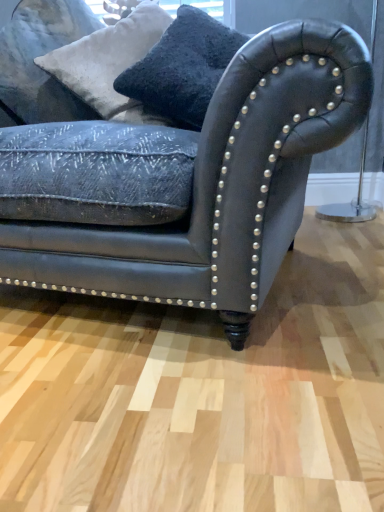
Question: Considering the relative positions of leather couch at center and velvety black pillow at upper center, the 2th pillow when ordered from left to right, in the image provided, is leather couch at center to the left of velvety black pillow at upper center, the 2th pillow when ordered from left to right, from the viewer's perspective?

Choices:
 (A) no
 (B) yes

Answer: (B)

Question: Are leather couch at center and velvety black pillow at upper center, the 1th pillow from the right, far apart?

Choices:
 (A) no
 (B) yes

Answer: (A)

Question: Can you confirm if leather couch at center is smaller than velvety black pillow at upper center, the 1th pillow from the right?

Choices:
 (A) yes
 (B) no

Answer: (B)

Question: Is leather couch at center oriented away from velvety black pillow at upper center, the 1th pillow from the right?

Choices:
 (A) no
 (B) yes

Answer: (A)

Question: Is velvety black pillow at upper center, the 2th pillow when ordered from left to right, a part of leather couch at center?

Choices:
 (A) yes
 (B) no

Answer: (A)

Question: Is white textured pillow at upper left, the 2th pillow in the right-to-left sequence, taller or shorter than leather couch at center?

Choices:
 (A) short
 (B) tall

Answer: (A)

Question: From a real-world perspective, is white textured pillow at upper left, the first pillow viewed from the left, above or below leather couch at center?

Choices:
 (A) above
 (B) below

Answer: (A)

Question: Choose the correct answer: Is white textured pillow at upper left, the 2th pillow in the right-to-left sequence, inside leather couch at center or outside it?

Choices:
 (A) outside
 (B) inside

Answer: (B)

Question: Considering the positions of white textured pillow at upper left, the 2th pillow in the right-to-left sequence, and leather couch at center in the image, is white textured pillow at upper left, the 2th pillow in the right-to-left sequence, wider or thinner than leather couch at center?

Choices:
 (A) thin
 (B) wide

Answer: (A)

Question: Considering the relative positions of velvety black pillow at upper center, the 2th pillow when ordered from left to right, and white textured pillow at upper left, the 2th pillow in the right-to-left sequence, in the image provided, is velvety black pillow at upper center, the 2th pillow when ordered from left to right, to the left or to the right of white textured pillow at upper left, the 2th pillow in the right-to-left sequence,?

Choices:
 (A) right
 (B) left

Answer: (A)

Question: Considering the positions of velvety black pillow at upper center, the 1th pillow from the right, and white textured pillow at upper left, the first pillow viewed from the left, in the image, is velvety black pillow at upper center, the 1th pillow from the right, taller or shorter than white textured pillow at upper left, the first pillow viewed from the left,?

Choices:
 (A) short
 (B) tall

Answer: (A)

Question: Relative to white textured pillow at upper left, the 2th pillow in the right-to-left sequence, is velvety black pillow at upper center, the 1th pillow from the right, in front or behind?

Choices:
 (A) front
 (B) behind

Answer: (A)

Question: Considering the positions of point [x=152, y=53] and point [x=127, y=15], is point [x=152, y=53] closer or farther from the camera than point [x=127, y=15]?

Choices:
 (A) farther
 (B) closer

Answer: (B)

Question: In terms of height, does white textured pillow at upper left, the 2th pillow in the right-to-left sequence, look taller or shorter compared to velvety black pillow at upper center, the 2th pillow when ordered from left to right?

Choices:
 (A) short
 (B) tall

Answer: (B)

Question: Considering their positions, is white textured pillow at upper left, the 2th pillow in the right-to-left sequence, located in front of or behind velvety black pillow at upper center, the 1th pillow from the right?

Choices:
 (A) behind
 (B) front

Answer: (A)